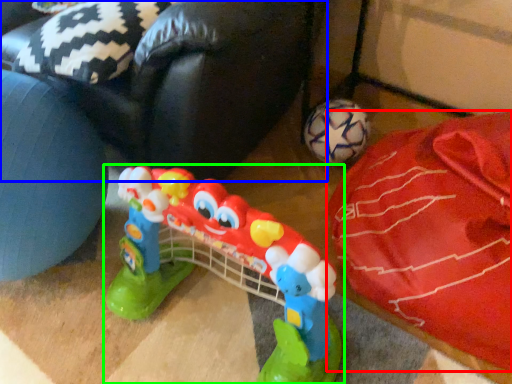
Question: Which object is positioned closest to material (highlighted by a red box)? Select from bean bag chair (highlighted by a blue box) and toy (highlighted by a green box).

Choices:
 (A) bean bag chair
 (B) toy

Answer: (B)